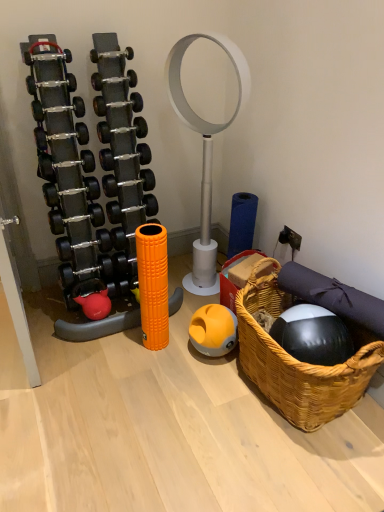
Describe the element at coordinates (213, 330) in the screenshot. I see `orange rubber ball at center` at that location.

Image resolution: width=384 pixels, height=512 pixels. Describe the element at coordinates (92, 298) in the screenshot. I see `rubberized red kettlebell at lower left` at that location.

Looking at this image, what is the approximate width of woven brown basket at lower right?

20.80 inches.

Locate an element on the screen. This screenshot has height=512, width=384. matte black dumbbell at center is located at coordinates (117, 104).

How many degrees apart are the facing directions of matte black dumbbell at center and orange rubber ball at center?

They differ by 92.4 degrees in their facing directions.

Is matte black dumbbell at center looking in the opposite direction of orange rubber ball at center?

No.

In the scene shown: In terms of size, does matte black dumbbell at center appear bigger or smaller than orange rubber ball at center?

matte black dumbbell at center is smaller than orange rubber ball at center.

Consider the image. Are matte black dumbbell at center and orange rubber ball at center making contact?

No, matte black dumbbell at center is not with orange rubber ball at center.

How different are the orientations of orange rubber ball at center and matte black dumbbell at center in degrees?

The angle between the facing direction of orange rubber ball at center and the facing direction of matte black dumbbell at center is 92.4 degrees.

Which object is thinner, orange rubber ball at center or matte black dumbbell at center?

Thinner between the two is matte black dumbbell at center.

Is orange rubber ball at center oriented towards matte black dumbbell at center?

No.

Would you say orange rubber ball at center is outside matte black dumbbell at center?

Yes, orange rubber ball at center is outside of matte black dumbbell at center.

From the image's perspective, which one is positioned higher, matte black dumbbell at center or rubberized red kettlebell at lower left?

matte black dumbbell at center.

Can you tell me how much matte black dumbbell at center and rubberized red kettlebell at lower left differ in facing direction?

The facing directions of matte black dumbbell at center and rubberized red kettlebell at lower left are 2.37 degrees apart.

From the picture: Is matte black dumbbell at center positioned with its back to rubberized red kettlebell at lower left?

No, matte black dumbbell at center is not facing the opposite direction of rubberized red kettlebell at lower left.

Between point (96, 114) and point (103, 304), which one is positioned behind?

Point (103, 304)

From the image's perspective, is rubberized red kettlebell at lower left located beneath woven brown basket at lower right?

No.

Does rubberized red kettlebell at lower left touch woven brown basket at lower right?

No, rubberized red kettlebell at lower left is not touching woven brown basket at lower right.

Is woven brown basket at lower right completely or partially inside rubberized red kettlebell at lower left?

No, woven brown basket at lower right is not inside rubberized red kettlebell at lower left.

How many degrees apart are the facing directions of rubberized red kettlebell at lower left and woven brown basket at lower right?

The angle between the facing direction of rubberized red kettlebell at lower left and the facing direction of woven brown basket at lower right is 90 degrees.

From a real-world perspective, which is physically above, orange rubber ball at center or rubberized red kettlebell at lower left?

In real-world perspective, rubberized red kettlebell at lower left is above.

Is point (219, 317) positioned behind point (103, 289)?

No, (219, 317) is in front of (103, 289).

Does orange rubber ball at center turn towards rubberized red kettlebell at lower left?

No, orange rubber ball at center is not aimed at rubberized red kettlebell at lower left.

Considering the relative positions of orange rubber ball at center and woven brown basket at lower right in the image provided, is orange rubber ball at center behind woven brown basket at lower right?

Yes.

Is orange rubber ball at center wider or thinner than woven brown basket at lower right?

Clearly, orange rubber ball at center has less width compared to woven brown basket at lower right.

From a real-world perspective, between orange rubber ball at center and woven brown basket at lower right, who is vertically higher?

From a 3D spatial view, woven brown basket at lower right is above.

From the image's perspective, which object appears higher, orange rubber ball at center or woven brown basket at lower right?

woven brown basket at lower right, from the image's perspective.

Looking at this image, is rubberized red kettlebell at lower left not close to orange rubber ball at center?

No.

Consider the image. Does rubberized red kettlebell at lower left have a lesser width compared to orange rubber ball at center?

Yes, rubberized red kettlebell at lower left is thinner than orange rubber ball at center.

From a real-world perspective, which object rests below the other?

orange rubber ball at center is physically lower.

Is rubberized red kettlebell at lower left inside or outside of orange rubber ball at center?

rubberized red kettlebell at lower left is spatially situated outside orange rubber ball at center.

In order to click on dumbbell lying above the orange rubber ball at center (from the image's perspective) in this screenshot , I will do pos(117,104).

Identify the location of ball below the matte black dumbbell at center (from the image's perspective). The image size is (384, 512). (213, 330).

Based on their spatial positions, is rubberized red kettlebell at lower left or matte black dumbbell at center further from orange rubber ball at center?

Among the two, matte black dumbbell at center is located further to orange rubber ball at center.

When comparing their distances from rubberized red kettlebell at lower left, does orange rubber ball at center or matte black dumbbell at center seem closer?

orange rubber ball at center is closer to rubberized red kettlebell at lower left.

When comparing their distances from matte black dumbbell at center, does orange rubber ball at center or rubberized red kettlebell at lower left seem closer?

rubberized red kettlebell at lower left is positioned closer to the anchor matte black dumbbell at center.

When comparing their distances from matte black dumbbell at center, does woven brown basket at lower right or orange rubber ball at center seem further?

woven brown basket at lower right.

Based on their spatial positions, is woven brown basket at lower right or matte black dumbbell at center closer to orange rubber ball at center?

Based on the image, woven brown basket at lower right appears to be nearer to orange rubber ball at center.

When comparing their distances from woven brown basket at lower right, does rubberized red kettlebell at lower left or orange rubber ball at center seem closer?

orange rubber ball at center lies closer to woven brown basket at lower right than the other object.

Estimate the real-world distances between objects in this image. Which object is further from matte black dumbbell at center, woven brown basket at lower right or rubberized red kettlebell at lower left?

Based on the image, woven brown basket at lower right appears to be further to matte black dumbbell at center.

When comparing their distances from rubberized red kettlebell at lower left, does woven brown basket at lower right or matte black dumbbell at center seem further?

woven brown basket at lower right.

The image size is (384, 512). Find the location of `ball between rubberized red kettlebell at lower left and woven brown basket at lower right`. ball between rubberized red kettlebell at lower left and woven brown basket at lower right is located at coordinates (213, 330).

Find the location of `toy that lies between matte black dumbbell at center and woven brown basket at lower right from top to bottom`. toy that lies between matte black dumbbell at center and woven brown basket at lower right from top to bottom is located at coordinates (92, 298).

You are a GUI agent. You are given a task and a screenshot of the screen. Output one action in this format:
    pyautogui.click(x=<x>, y=<y>)
    Task: Click on the toy that lies between matte black dumbbell at center and orange rubber ball at center from top to bottom
    
    Given the screenshot: What is the action you would take?
    pyautogui.click(x=92, y=298)

Where is `basket between matte black dumbbell at center and orange rubber ball at center vertically`? This screenshot has height=512, width=384. basket between matte black dumbbell at center and orange rubber ball at center vertically is located at coordinates (298, 362).